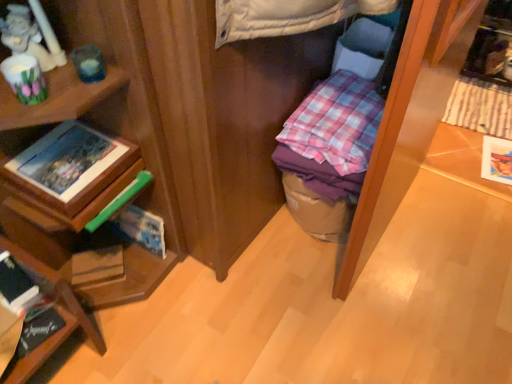
Locate an element on the screen. This screenshot has height=384, width=512. free space in front of matte brown book at lower left, which appears as the second paperback book when viewed from the back is located at coordinates (104, 326).